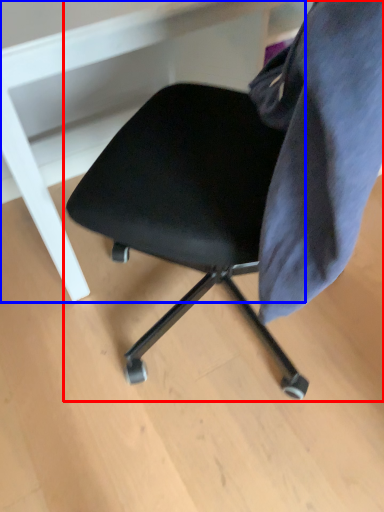
Question: Which point is further to the camera, chair (highlighted by a red box) or vanity (highlighted by a blue box)?

Choices:
 (A) chair
 (B) vanity

Answer: (B)